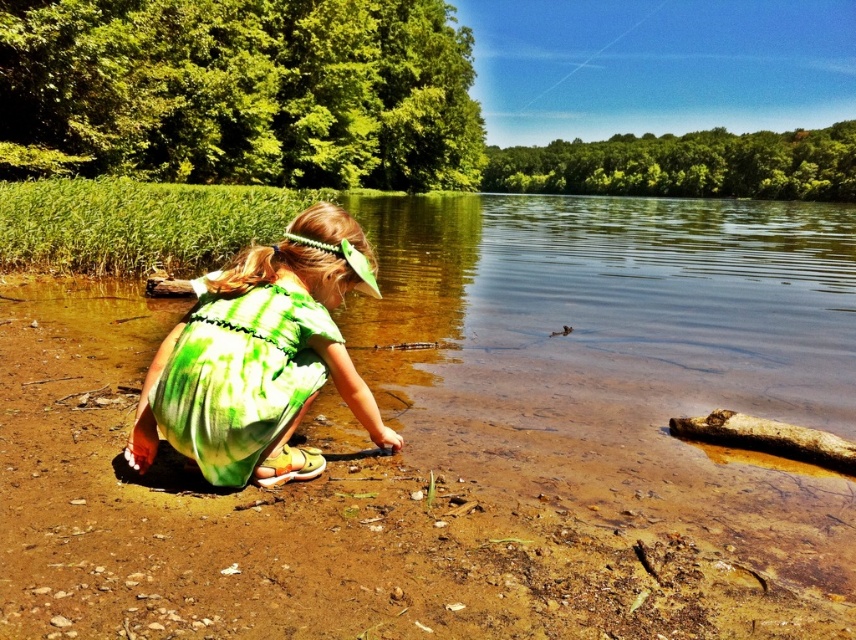
You are a small frog trying to jump from the brown dirt at lower left to the brown rough log at lower right. Can you land safely on the log without falling into the water?

The brown dirt at lower left is positioned under brown rough log at lower right, so the log is directly above the dirt. Since the frog can jump from the dirt to the log below it, the frog can land safely on the brown rough log at lower right without falling into the water.